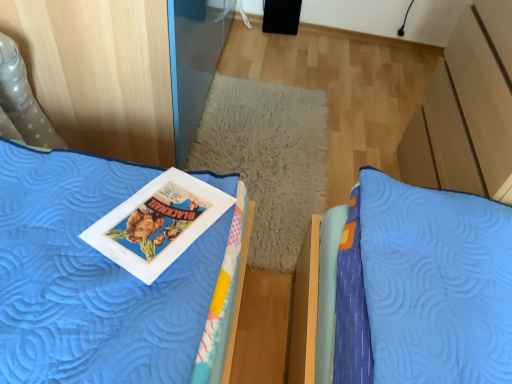
Image resolution: width=512 pixels, height=384 pixels. What do you see at coordinates (268, 159) in the screenshot?
I see `blue quilted pillow at center` at bounding box center [268, 159].

Find the location of a particular element. The height and width of the screenshot is (384, 512). blue quilted bed at upper left is located at coordinates (222, 305).

The image size is (512, 384). What are the coordinates of `matte paper comic book at center-left` in the screenshot? It's located at (158, 223).

Considering the relative sizes of matte paper comic book at center-left and blue quilted bed at upper left in the image provided, is matte paper comic book at center-left taller than blue quilted bed at upper left?

No.

Which of these two, matte paper comic book at center-left or blue quilted bed at upper left, is smaller?

Smaller between the two is matte paper comic book at center-left.

In the scene shown: Is blue quilted bed at upper left completely or partially inside matte paper comic book at center-left?

That's incorrect, blue quilted bed at upper left is not inside matte paper comic book at center-left.

From a real-world perspective, is matte paper comic book at center-left over blue quilted bed at upper left?

Yes, from a real-world perspective, matte paper comic book at center-left is over blue quilted bed at upper left

Is point (202, 347) more distant than point (212, 210)?

No.

Is blue quilted bed at upper left facing away from matte paper comic book at center-left?

Absolutely, blue quilted bed at upper left is directed away from matte paper comic book at center-left.

Is blue quilted bed at upper left at the left side of matte paper comic book at center-left?

Yes, blue quilted bed at upper left is to the left of matte paper comic book at center-left.

Which of these two, blue quilted bed at upper left or blue quilted pillow at center, stands shorter?

blue quilted pillow at center.

Is blue quilted bed at upper left located outside blue quilted pillow at center?

blue quilted bed at upper left lies outside blue quilted pillow at center's area.

Which is behind, blue quilted bed at upper left or blue quilted pillow at center?

blue quilted pillow at center is further away from the camera.

Looking at this image, is blue quilted bed at upper left positioned far away from blue quilted pillow at center?

No, blue quilted bed at upper left is in close proximity to blue quilted pillow at center.

Is matte paper comic book at center-left further to the viewer compared to blue quilted pillow at center?

No.

Which is more to the left, matte paper comic book at center-left or blue quilted pillow at center?

matte paper comic book at center-left is more to the left.

Who is taller, matte paper comic book at center-left or blue quilted pillow at center?

matte paper comic book at center-left.

Is matte paper comic book at center-left in contact with blue quilted pillow at center?

matte paper comic book at center-left and blue quilted pillow at center are clearly separated.

Consider the image. From the image's perspective, does blue quilted pillow at center appear higher than blue quilted bed at upper left?

Yes, from the image's perspective, blue quilted pillow at center is over blue quilted bed at upper left.

Is blue quilted pillow at center positioned beyond the bounds of blue quilted bed at upper left?

blue quilted pillow at center is positioned outside blue quilted bed at upper left.

From a real-world perspective, which object stands above the other?

From a 3D spatial view, blue quilted bed at upper left is above.

Can you tell me how much blue quilted pillow at center and blue quilted bed at upper left differ in facing direction?

The angle between the facing direction of blue quilted pillow at center and the facing direction of blue quilted bed at upper left is 0.00855 degrees.

Which object is wider, blue quilted pillow at center or matte paper comic book at center-left?

blue quilted pillow at center is wider.

Is blue quilted pillow at center positioned beyond the bounds of matte paper comic book at center-left?

Yes, blue quilted pillow at center is located beyond the bounds of matte paper comic book at center-left.

Does point (266, 114) come behind point (207, 184)?

Yes, point (266, 114) is behind point (207, 184).

Is blue quilted pillow at center to the left of matte paper comic book at center-left from the viewer's perspective?

In fact, blue quilted pillow at center is to the right of matte paper comic book at center-left.

Identify the location of comic book that is above the blue quilted bed at upper left (from a real-world perspective). The width and height of the screenshot is (512, 384). pos(158,223).

Identify the location of comic book above the blue quilted bed at upper left (from the image's perspective). This screenshot has width=512, height=384. (158, 223).

Considering their positions, is matte paper comic book at center-left positioned further to blue quilted bed at upper left than blue quilted pillow at center?

Among the two, blue quilted pillow at center is located further to blue quilted bed at upper left.

Which object lies nearer to the anchor point blue quilted pillow at center, blue quilted bed at upper left or matte paper comic book at center-left?

Based on the image, blue quilted bed at upper left appears to be nearer to blue quilted pillow at center.

From the image, which object appears to be nearer to matte paper comic book at center-left, blue quilted pillow at center or blue quilted bed at upper left?

The object closer to matte paper comic book at center-left is blue quilted bed at upper left.

Which object lies nearer to the anchor point blue quilted bed at upper left, blue quilted pillow at center or matte paper comic book at center-left?

matte paper comic book at center-left.

Estimate the real-world distances between objects in this image. Which object is closer to blue quilted pillow at center, matte paper comic book at center-left or blue quilted bed at upper left?

blue quilted bed at upper left is closer to blue quilted pillow at center.

Which object lies nearer to the anchor point matte paper comic book at center-left, blue quilted bed at upper left or blue quilted pillow at center?

blue quilted bed at upper left is positioned closer to the anchor matte paper comic book at center-left.

Locate an element on the screen. This screenshot has height=384, width=512. comic book positioned between blue quilted bed at upper left and blue quilted pillow at center from near to far is located at coordinates (158, 223).